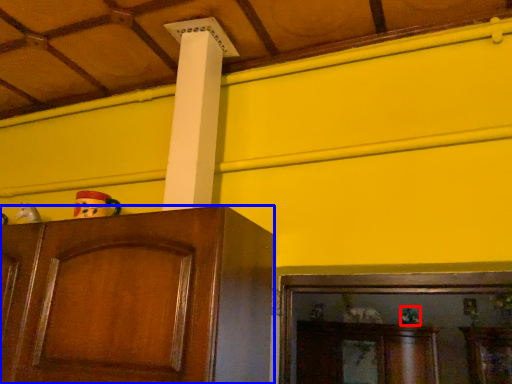
Question: Among these objects, which one is farthest to the camera, toy (highlighted by a red box) or cabinetry (highlighted by a blue box)?

Choices:
 (A) toy
 (B) cabinetry

Answer: (A)